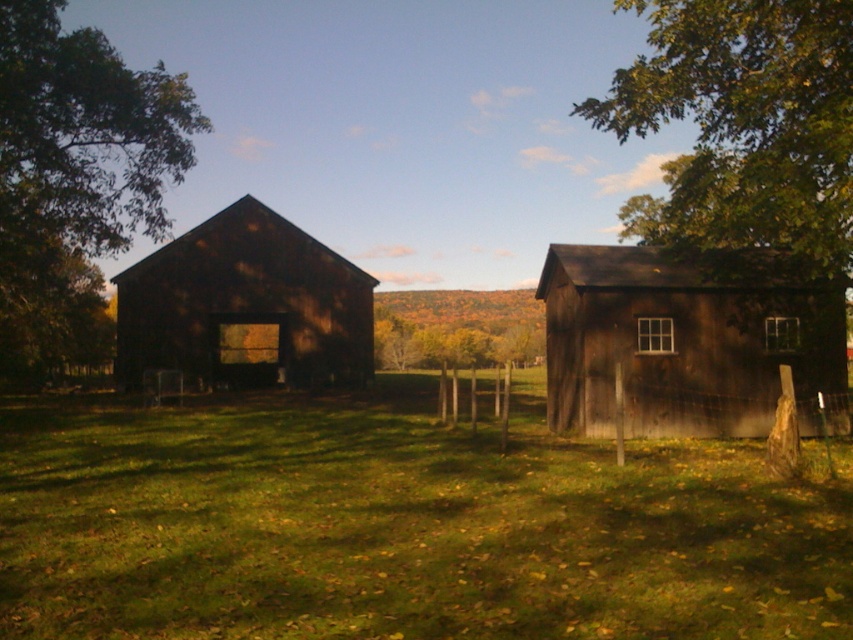
Question: Does dark brown wooden barn at center have a greater width compared to yellow-green leaves at center?

Choices:
 (A) no
 (B) yes

Answer: (A)

Question: Among these points, which one is nearest to the camera?

Choices:
 (A) (120, 109)
 (B) (498, 394)
 (C) (698, 227)
 (D) (704, 412)

Answer: (D)

Question: Which object is the closest to the green leafy tree at upper right?

Choices:
 (A) dark brown wooden barn at right
 (B) dark brown wooden barn at center
 (C) yellow-green leaves at center

Answer: (A)

Question: Does green matte tree at left have a larger size compared to dark brown wooden barn at center?

Choices:
 (A) yes
 (B) no

Answer: (A)

Question: Does green leafy tree at upper right appear over green matte tree at left?

Choices:
 (A) no
 (B) yes

Answer: (B)

Question: Which object appears closest to the camera in this image?

Choices:
 (A) dark brown wooden barn at right
 (B) green leafy tree at upper right

Answer: (B)